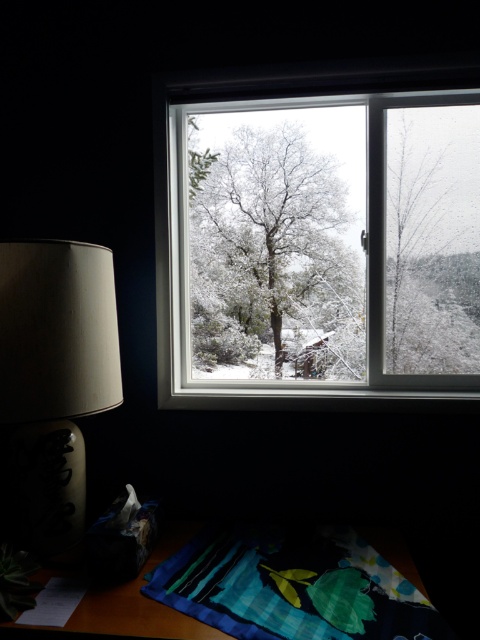
Question: Does snow-covered tree at center appear over snow-covered tree at right?

Choices:
 (A) no
 (B) yes

Answer: (A)

Question: Can you confirm if clear glass window at center is positioned to the left of matte beige lamp at left?

Choices:
 (A) yes
 (B) no

Answer: (B)

Question: Estimate the real-world distances between objects in this image. Which object is farther from the clear glass window at center?

Choices:
 (A) snow-covered tree at center
 (B) snow-covered tree at right

Answer: (B)

Question: Can you confirm if matte beige lamp at left is smaller than snow-covered tree at right?

Choices:
 (A) no
 (B) yes

Answer: (A)

Question: Among these objects, which one is nearest to the camera?

Choices:
 (A) snow-covered tree at center
 (B) snow-covered tree at right
 (C) matte beige lamp at left
 (D) clear glass window at center

Answer: (C)

Question: Which object appears closest to the camera in this image?

Choices:
 (A) clear glass window at center
 (B) snow-covered tree at right

Answer: (A)